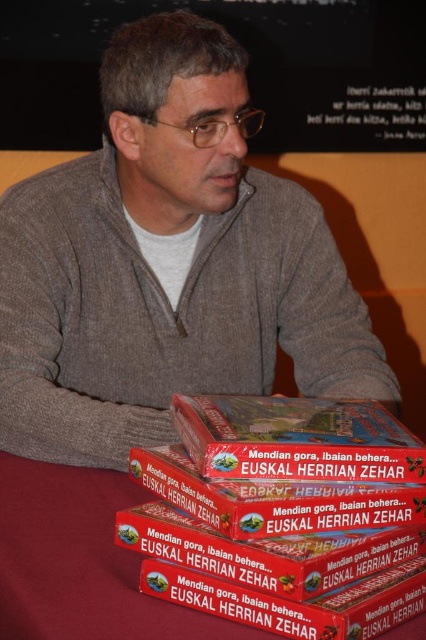
Question: Which point is closer to the camera?

Choices:
 (A) (393, 145)
 (B) (89, 561)
 (C) (293, 497)
 (D) (357, 595)

Answer: (D)

Question: Can you confirm if matte cardboard box at center is smaller than red cardboard box at center?

Choices:
 (A) no
 (B) yes

Answer: (A)

Question: Among these points, which one is nearest to the camera?

Choices:
 (A) (293, 612)
 (B) (287, 449)

Answer: (A)

Question: Does matte gray sweater at center appear on the left side of matte cardboard box at lower center?

Choices:
 (A) no
 (B) yes

Answer: (B)

Question: Is brown cardboard boxes at lower center to the right of matte cardboard box at lower center from the viewer's perspective?

Choices:
 (A) no
 (B) yes

Answer: (A)

Question: Considering the real-world distances, which object is closest to the matte gray sweater at center?

Choices:
 (A) brown cardboard boxes at lower center
 (B) orange matte bulletin board at upper center
 (C) red cardboard box at center

Answer: (A)